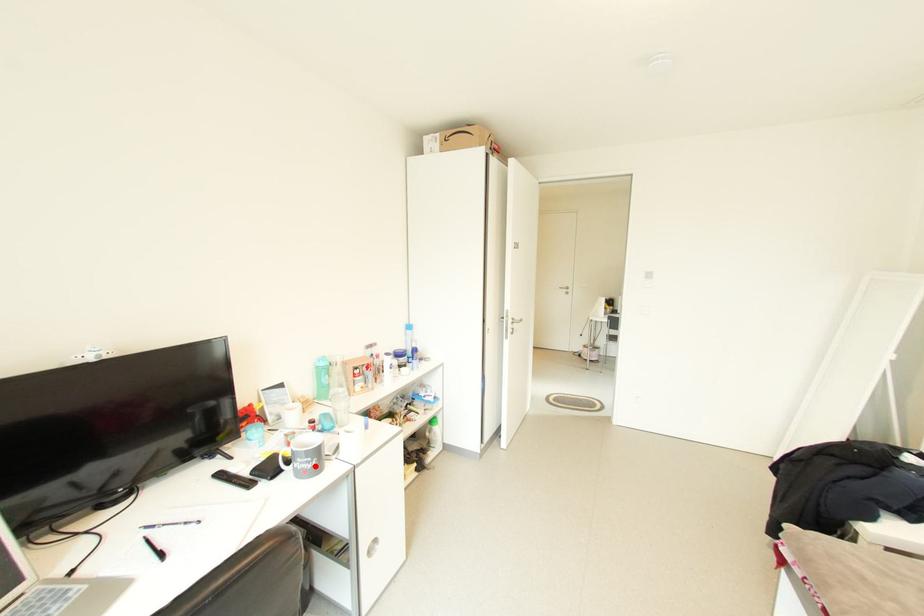
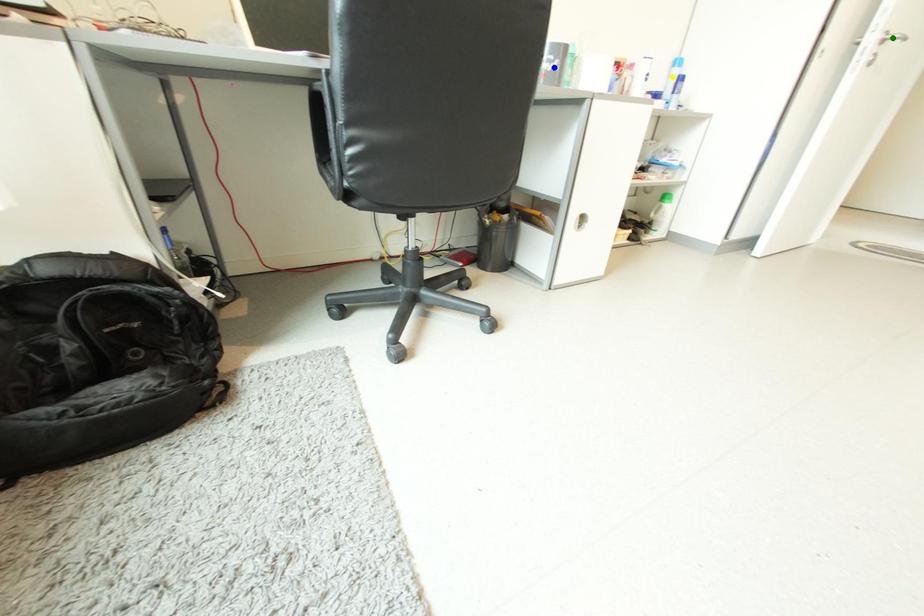
Question: I am providing you with two images of the same scene from different viewpoints. A red point is marked on the first image. You are given multiple points on the second image. Which spot in image 2 lines up with the point in image 1?

Choices:
 (A) blue point
 (B) green point
 (C) yellow point

Answer: (A)